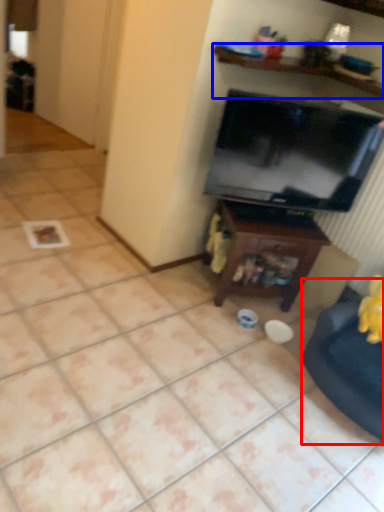
Question: Among these objects, which one is farthest to the camera, swivel chair (highlighted by a red box) or shelf (highlighted by a blue box)?

Choices:
 (A) swivel chair
 (B) shelf

Answer: (B)